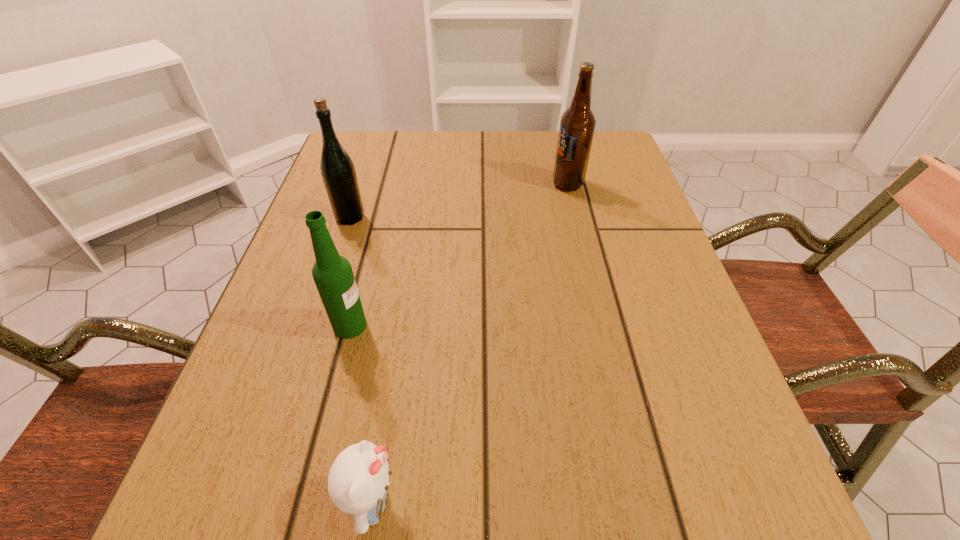
I want to click on the farthest beer bottle, so click(x=577, y=124).

Find the location of a particular element. Image resolution: width=960 pixels, height=540 pixels. the rightmost object is located at coordinates (577, 124).

Locate an element on the screen. The image size is (960, 540). the leftmost object is located at coordinates (338, 172).

This screenshot has width=960, height=540. Find the location of `the second nearest beer bottle`. the second nearest beer bottle is located at coordinates (338, 172).

Image resolution: width=960 pixels, height=540 pixels. I want to click on the third object from right to left, so click(332, 273).

Where is `the nearest beer bottle`? the nearest beer bottle is located at coordinates (332, 273).

Identify the location of free space located on the label of the rightmost beer bottle. coord(493,184).

The width and height of the screenshot is (960, 540). What are the coordinates of `vacant space located 0.310m on the label of the rightmost beer bottle` in the screenshot? It's located at (420, 184).

The height and width of the screenshot is (540, 960). In order to click on free space located on the label of the rightmost beer bottle in this screenshot , I will do `click(515, 184)`.

Locate an element on the screen. The width and height of the screenshot is (960, 540). blank space located on the right of the third nearest object is located at coordinates (550, 217).